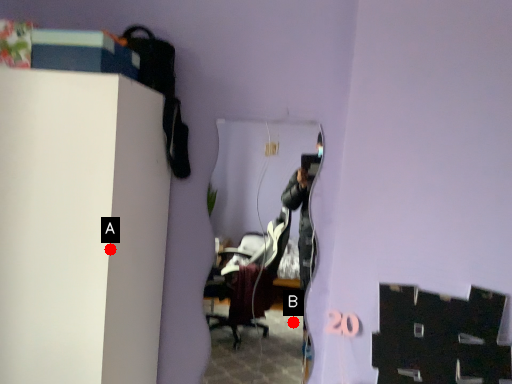
Question: Two points are circled on the image, labeled by A and B beside each circle. Which of the following is the farthest from the observer?

Choices:
 (A) A is further
 (B) B is further

Answer: (B)